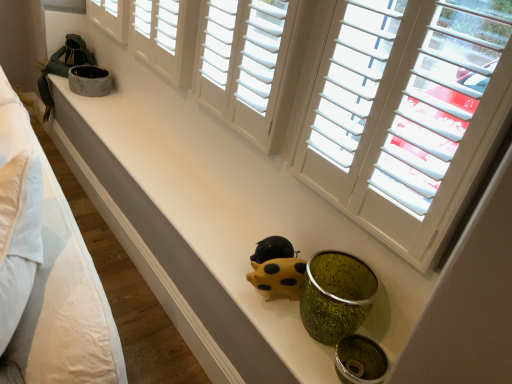
Question: Is yellow matte piggy bank at center shorter than white wood shutters at upper center, the first window viewed from the left?

Choices:
 (A) yes
 (B) no

Answer: (A)

Question: Is yellow matte piggy bank at center taller than white wood shutters at upper center, which appears as the second window when viewed from the right?

Choices:
 (A) no
 (B) yes

Answer: (A)

Question: From the image's perspective, is yellow matte piggy bank at center located above white wood shutters at upper center, which appears as the second window when viewed from the right?

Choices:
 (A) no
 (B) yes

Answer: (A)

Question: Is yellow matte piggy bank at center oriented towards white wood shutters at upper center, which appears as the second window when viewed from the right?

Choices:
 (A) yes
 (B) no

Answer: (B)

Question: From a real-world perspective, is yellow matte piggy bank at center on white wood shutters at upper center, which appears as the second window when viewed from the right?

Choices:
 (A) yes
 (B) no

Answer: (B)

Question: Considering their positions, is white wood shutters at upper center, which appears as the second window when viewed from the right, located in front of or behind white matte window at upper center, which is counted as the second window, starting from the left?

Choices:
 (A) behind
 (B) front

Answer: (A)

Question: Looking at their shapes, would you say white wood shutters at upper center, the first window viewed from the left, is wider or thinner than white matte window at upper center, positioned as the first window in right-to-left order?

Choices:
 (A) wide
 (B) thin

Answer: (B)

Question: Looking at the image, does white wood shutters at upper center, which appears as the second window when viewed from the right, seem bigger or smaller compared to white matte window at upper center, positioned as the first window in right-to-left order?

Choices:
 (A) big
 (B) small

Answer: (B)

Question: Is point (244, 89) closer or farther from the camera than point (184, 31)?

Choices:
 (A) farther
 (B) closer

Answer: (B)

Question: Looking at their shapes, would you say white cotton bed at left is wider or thinner than white wood shutters at upper center, which appears as the second window when viewed from the right?

Choices:
 (A) wide
 (B) thin

Answer: (A)

Question: From the image's perspective, is white cotton bed at left located above or below white wood shutters at upper center, which appears as the second window when viewed from the right?

Choices:
 (A) below
 (B) above

Answer: (A)

Question: Is point (12, 122) closer or farther from the camera than point (250, 52)?

Choices:
 (A) farther
 (B) closer

Answer: (B)

Question: Considering their positions, is white cotton bed at left located in front of or behind white wood shutters at upper center, the first window viewed from the left?

Choices:
 (A) front
 (B) behind

Answer: (A)

Question: Looking at the image, does yellow matte piggy bank at center seem bigger or smaller compared to white cotton bed at left?

Choices:
 (A) small
 (B) big

Answer: (A)

Question: Would you say yellow matte piggy bank at center is to the left or to the right of white cotton bed at left in the picture?

Choices:
 (A) left
 (B) right

Answer: (B)